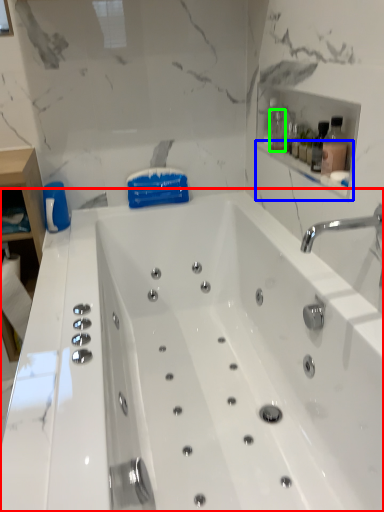
Question: Which is nearer to the bathtub (highlighted by a red box)? balustrade (highlighted by a blue box) or bottle (highlighted by a green box).

Choices:
 (A) balustrade
 (B) bottle

Answer: (A)